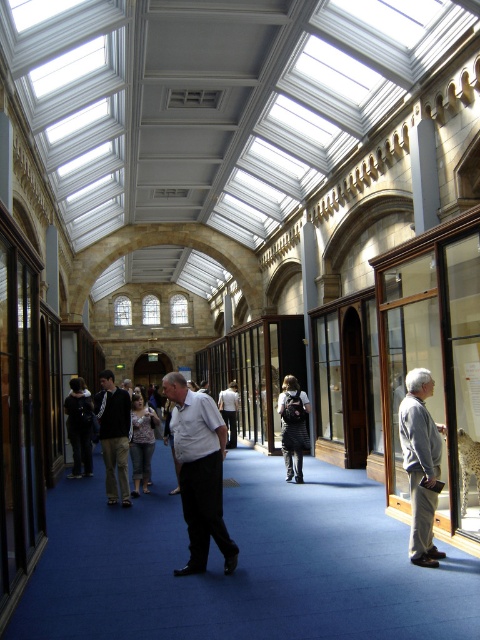
Is dark gray fabric pants at center positioned before dark gray fabric jacket at center?

That is True.

Consider the image. Does dark gray fabric pants at center appear on the left side of dark gray fabric jacket at center?

No, dark gray fabric pants at center is not to the left of dark gray fabric jacket at center.

Find the location of `dark gray fabric pants at center`. dark gray fabric pants at center is located at coordinates (113, 435).

Between white shirt at center and dark gray fabric pants at center, which one appears on the left side from the viewer's perspective?

dark gray fabric pants at center

Between point (213, 412) and point (109, 413), which one is positioned in front?

Point (213, 412) is in front.

Which is behind, point (188, 506) or point (104, 426)?

Point (104, 426)

This screenshot has width=480, height=640. I want to click on white shirt at center, so click(x=200, y=472).

Does gray fabric jacket at right appear under dark gray fabric jacket at center?

No, gray fabric jacket at right is not below dark gray fabric jacket at center.

Is gray fabric jacket at right further to camera compared to dark gray fabric jacket at center?

No, gray fabric jacket at right is in front of dark gray fabric jacket at center.

What do you see at coordinates (420, 464) in the screenshot? I see `gray fabric jacket at right` at bounding box center [420, 464].

Image resolution: width=480 pixels, height=640 pixels. In order to click on gray fabric jacket at right in this screenshot , I will do pyautogui.click(x=420, y=464).